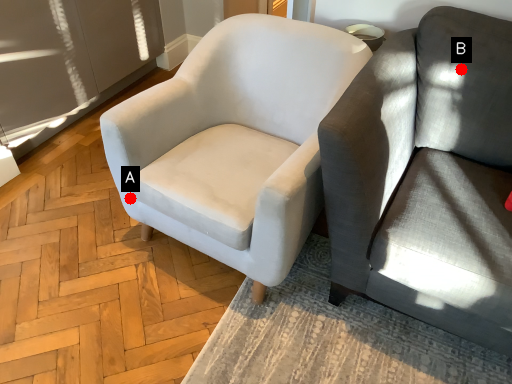
Question: Two points are circled on the image, labeled by A and B beside each circle. Which point is farther from the camera taking this photo?

Choices:
 (A) A is further
 (B) B is further

Answer: (A)